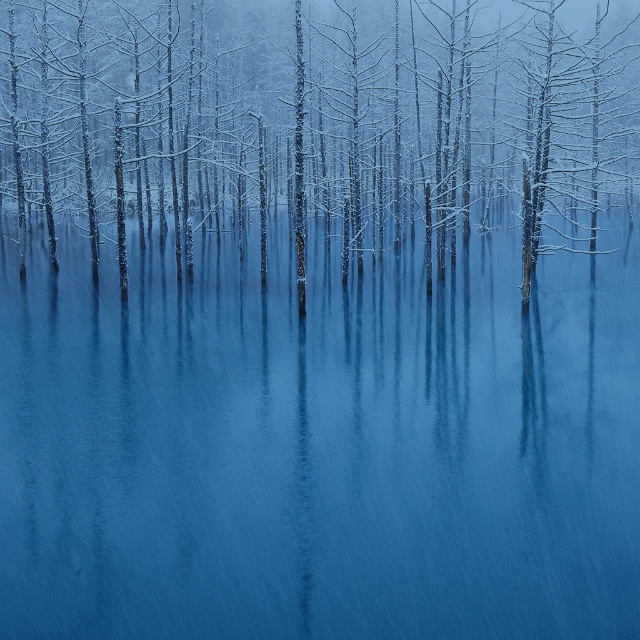
You are standing in the winter forest scene. There is a point marked at coordinates point (320,444). What is located at this point?

The point (320,444) corresponds to the blue glossy water at center.